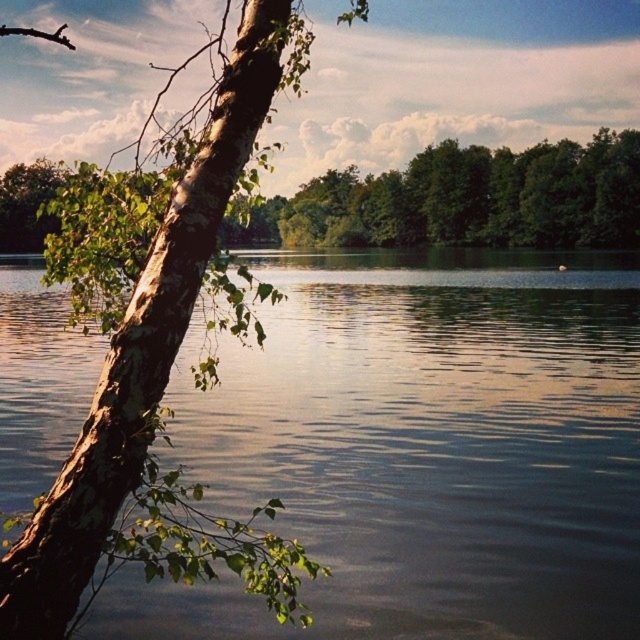
You are standing at the lakeside and want to take a photo of the smooth bark tree at left and the smooth water at center. Which object is located below the other in the image?

The smooth water at center is positioned under the smooth bark tree at left, so the smooth water at center is below the smooth bark tree at left in the image.

You are an artist planning to paint this lakeside scene. You want to ensure the green bark tree at upper left and the smooth water at center are proportionally accurate. Which object should be drawn taller in your painting?

The green bark tree at upper left should be drawn taller than the smooth water at center because the smooth water at center is not as tall as green bark tree at upper left.

You are standing at the edge of the lake and want to place a floating dock exactly at the center of the smooth water at center. According to the coordinates provided, where should you place the dock?

The smooth water at center is located at coordinates point (420, 449), so you should place the floating dock exactly at point (420, 449).